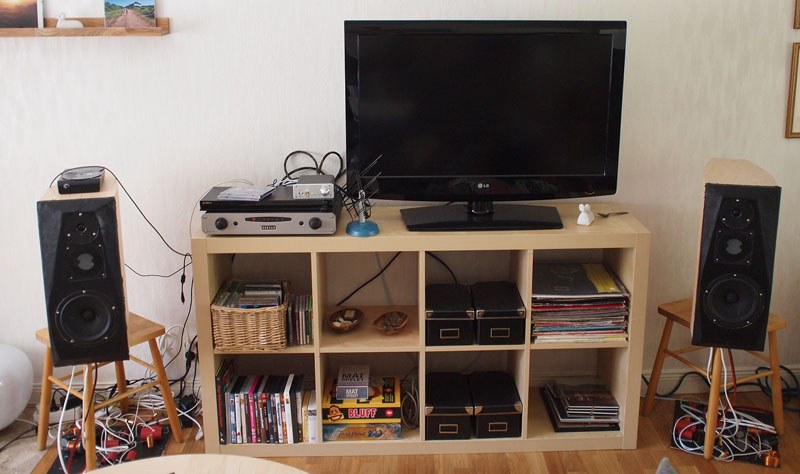
You are a GUI agent. You are given a task and a screenshot of the screen. Output one action in this format:
    pyautogui.click(x=<x>, y=<y>)
    Task: Click on the photo boxes
    This screenshot has height=474, width=800.
    Given the screenshot: What is the action you would take?
    pyautogui.click(x=464, y=323), pyautogui.click(x=496, y=322), pyautogui.click(x=450, y=417), pyautogui.click(x=502, y=416)